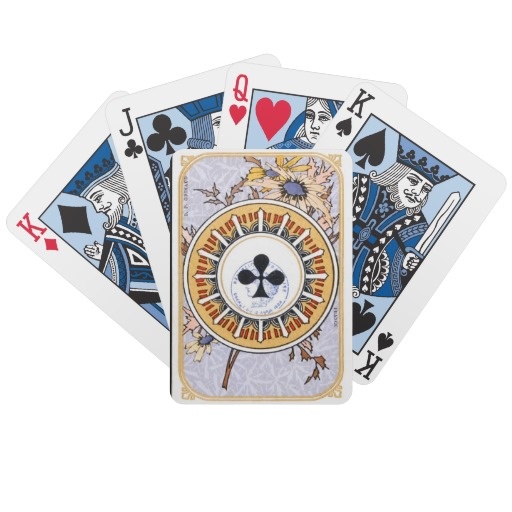
The width and height of the screenshot is (512, 512). I want to click on playing cards, so click(108, 245), click(173, 149), click(275, 100), click(392, 150), click(308, 278).